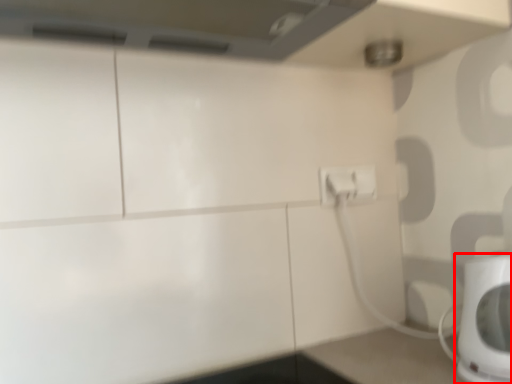
Question: From the image's perspective, what is the correct spatial relationship of home appliance (annotated by the red box) in relation to electric outlet?

Choices:
 (A) above
 (B) below

Answer: (B)